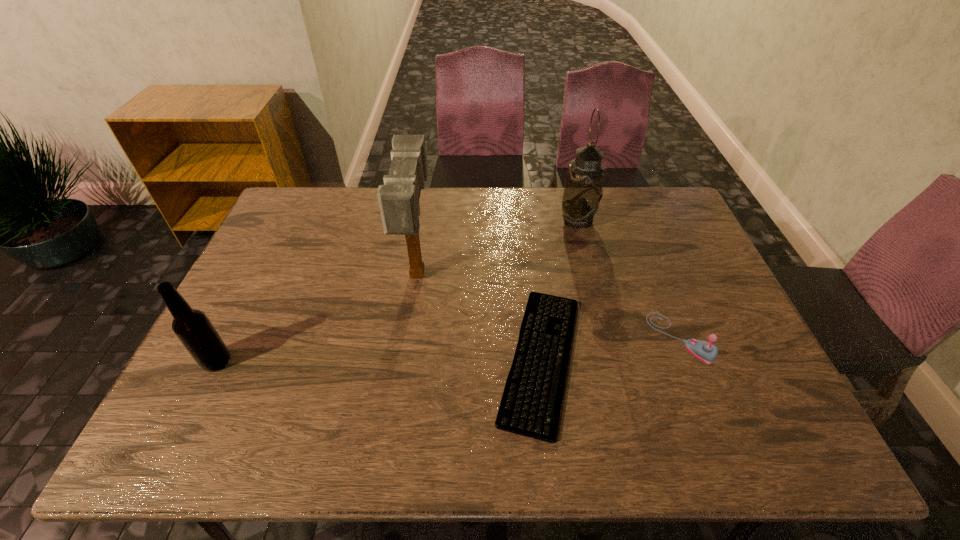
Where is `blank region between the computer keyboard and the farthest object`? This screenshot has height=540, width=960. blank region between the computer keyboard and the farthest object is located at coordinates (560, 289).

Identify the location of vacant space that is in between the computer keyboard and the leftmost object. (378, 360).

Where is `free spot between the second object from left to right and the computer keyboard`? free spot between the second object from left to right and the computer keyboard is located at coordinates tap(479, 316).

Identify the location of free area in between the third shortest object and the computer keyboard. Image resolution: width=960 pixels, height=540 pixels. (378, 360).

This screenshot has width=960, height=540. Find the location of `vacant area that lies between the rightmost object and the computer keyboard`. vacant area that lies between the rightmost object and the computer keyboard is located at coordinates (611, 348).

Locate an element on the screen. The image size is (960, 540). vacant space in between the fourth tallest object and the beer bottle is located at coordinates (448, 349).

This screenshot has height=540, width=960. What are the coordinates of `free space between the oil lamp and the rightmost object` in the screenshot? It's located at (630, 279).

What are the coordinates of `vacant region between the second object from left to right and the shortest object` in the screenshot? It's located at 479,316.

This screenshot has width=960, height=540. In order to click on object that is the second closest to the computer keyboard in this screenshot , I will do `click(398, 198)`.

Select which object appears as the third closest to the farthest object. Please provide its 2D coordinates. Your answer should be formatted as a tuple, i.e. [(x, y)], where the tuple contains the x and y coordinates of a point satisfying the conditions above.

[(398, 198)]